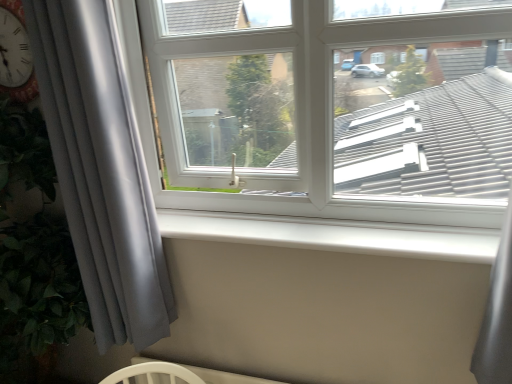
Question: From the image's perspective, would you say white smooth window sill at center is positioned over gray matte curtain at left?

Choices:
 (A) no
 (B) yes

Answer: (A)

Question: From a real-world perspective, is white smooth window sill at center below gray matte curtain at left?

Choices:
 (A) no
 (B) yes

Answer: (B)

Question: Is white smooth window sill at center bigger than gray matte curtain at left?

Choices:
 (A) no
 (B) yes

Answer: (A)

Question: Can you confirm if white smooth window sill at center is positioned to the left of gray matte curtain at left?

Choices:
 (A) no
 (B) yes

Answer: (A)

Question: Is gray matte curtain at left located within white smooth window sill at center?

Choices:
 (A) yes
 (B) no

Answer: (B)

Question: From a real-world perspective, is white smooth window sill at center located higher than gray matte curtain at left?

Choices:
 (A) no
 (B) yes

Answer: (A)

Question: Considering the relative sizes of white plastic window at center and gray matte curtain at left in the image provided, is white plastic window at center shorter than gray matte curtain at left?

Choices:
 (A) no
 (B) yes

Answer: (B)

Question: Can you confirm if white plastic window at center is thinner than gray matte curtain at left?

Choices:
 (A) no
 (B) yes

Answer: (A)

Question: Considering the relative positions of white plastic window at center and gray matte curtain at left in the image provided, is white plastic window at center to the left of gray matte curtain at left from the viewer's perspective?

Choices:
 (A) yes
 (B) no

Answer: (B)

Question: Is white plastic window at center at the right side of gray matte curtain at left?

Choices:
 (A) no
 (B) yes

Answer: (B)

Question: Can you confirm if white plastic window at center is bigger than gray matte curtain at left?

Choices:
 (A) no
 (B) yes

Answer: (B)

Question: Is white plastic window at center completely or partially outside of gray matte curtain at left?

Choices:
 (A) yes
 (B) no

Answer: (A)

Question: Does white smooth window sill at center appear on the right side of white plastic window at center?

Choices:
 (A) yes
 (B) no

Answer: (A)